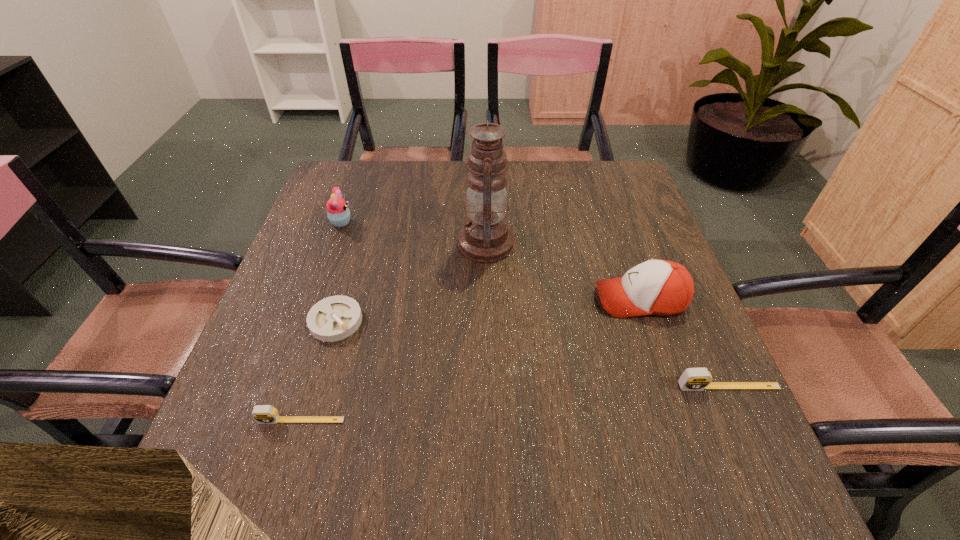
To achieve even spacing by inserting another tape_measure among them, please point to a vacant spot for this new tape_measure. Please provide its 2D coordinates. Your answer should be formatted as a tuple, i.e. [(x, y)], where the tuple contains the x and y coordinates of a point satisfying the conditions above.

[(521, 403)]